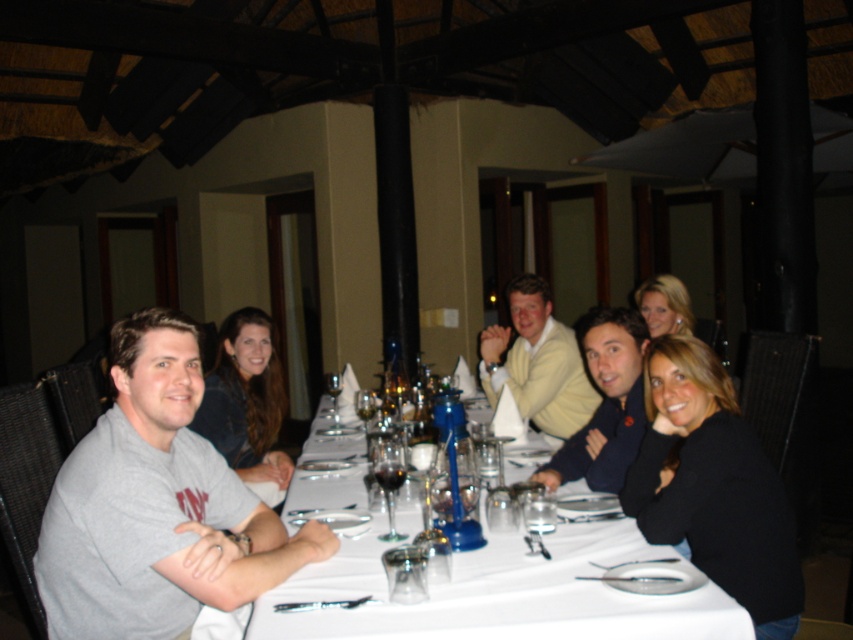
Which of these two, light yellow sweater at center or matte gray shirt at center, stands taller?

Standing taller between the two is light yellow sweater at center.

The width and height of the screenshot is (853, 640). I want to click on light yellow sweater at center, so 537,362.

Where is `light yellow sweater at center`? This screenshot has height=640, width=853. light yellow sweater at center is located at coordinates [537, 362].

Who is more forward, (560, 384) or (590, 438)?

Point (590, 438)

Between light yellow sweater at center and dark blue sweater at center, which one has more height?

Standing taller between the two is light yellow sweater at center.

Where is `light yellow sweater at center`? light yellow sweater at center is located at coordinates (537, 362).

Locate an element on the screen. The image size is (853, 640). light yellow sweater at center is located at coordinates (537, 362).

Can you confirm if white cloth at center is positioned to the right of clear glass wine glass at center?

Indeed, white cloth at center is positioned on the right side of clear glass wine glass at center.

Measure the distance between point (669,604) and camera.

They are 5.35 feet apart.

The width and height of the screenshot is (853, 640). What are the coordinates of `white cloth at center` in the screenshot? It's located at (498, 593).